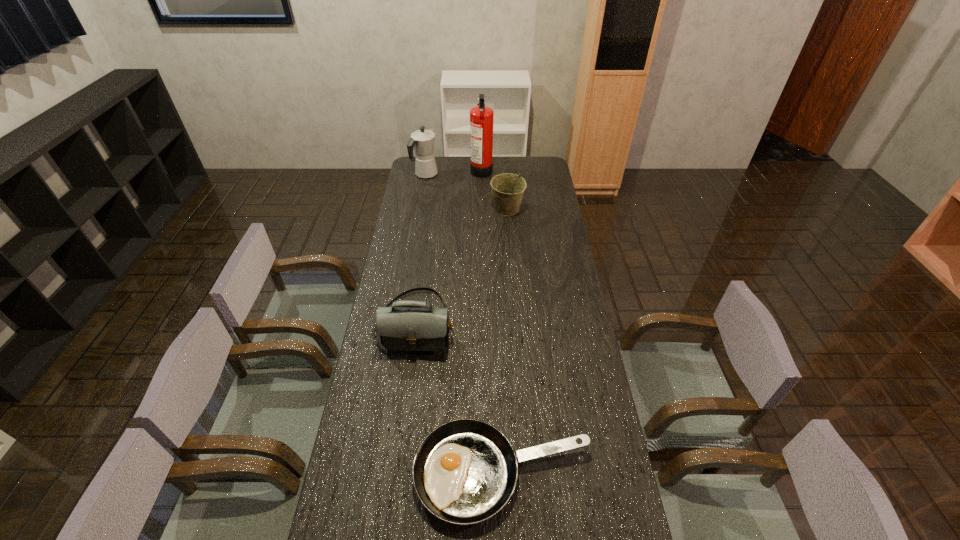
Where is `vacant space located on the front of the coffeepot`? This screenshot has height=540, width=960. vacant space located on the front of the coffeepot is located at coordinates (418, 218).

Where is `vacant space located 0.360m on the back of the wine bucket`? The height and width of the screenshot is (540, 960). vacant space located 0.360m on the back of the wine bucket is located at coordinates (504, 163).

I want to click on blank area located on the back of the second nearest object, so click(x=426, y=250).

Image resolution: width=960 pixels, height=540 pixels. I want to click on vacant space situated on the back of the frying pan, so [498, 354].

Image resolution: width=960 pixels, height=540 pixels. What are the coordinates of `fire extinguisher present at the far edge` in the screenshot? It's located at (481, 117).

Locate an element on the screen. This screenshot has height=540, width=960. coffeepot positioned at the far edge is located at coordinates (422, 141).

Find the location of `coffeepot positioned at the left edge`. coffeepot positioned at the left edge is located at coordinates (422, 141).

Locate an element on the screen. shoulder bag that is at the left edge is located at coordinates (415, 328).

Image resolution: width=960 pixels, height=540 pixels. I want to click on object at the right edge, so click(x=465, y=471).

Locate an element on the screen. This screenshot has height=540, width=960. object that is at the far left corner is located at coordinates (422, 141).